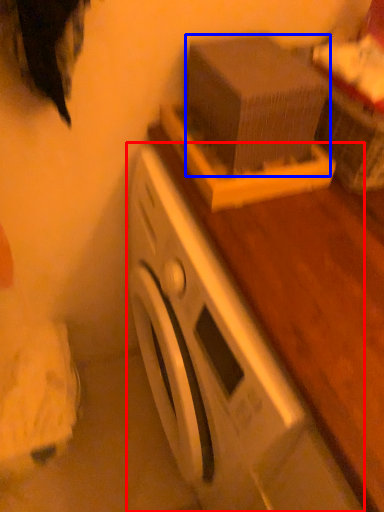
Question: Among these objects, which one is farthest to the camera, washing machine (highlighted by a red box) or box (highlighted by a blue box)?

Choices:
 (A) washing machine
 (B) box

Answer: (B)